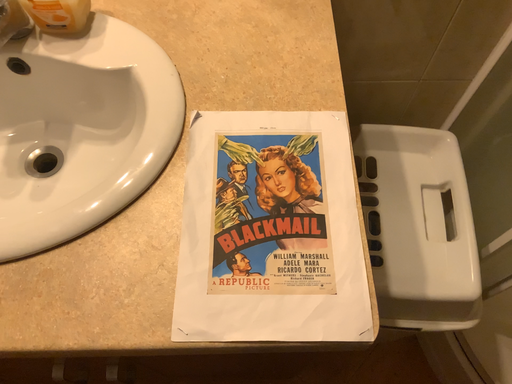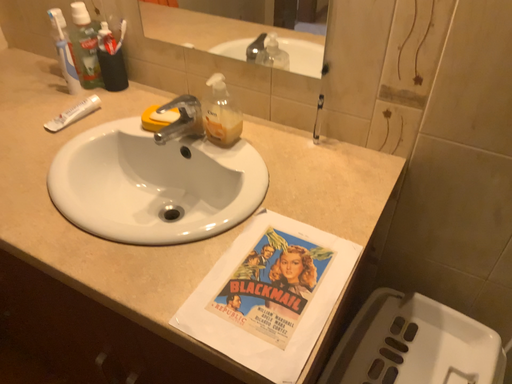
Question: Which way did the camera rotate in the video?

Choices:
 (A) rotated upward
 (B) rotated downward

Answer: (A)